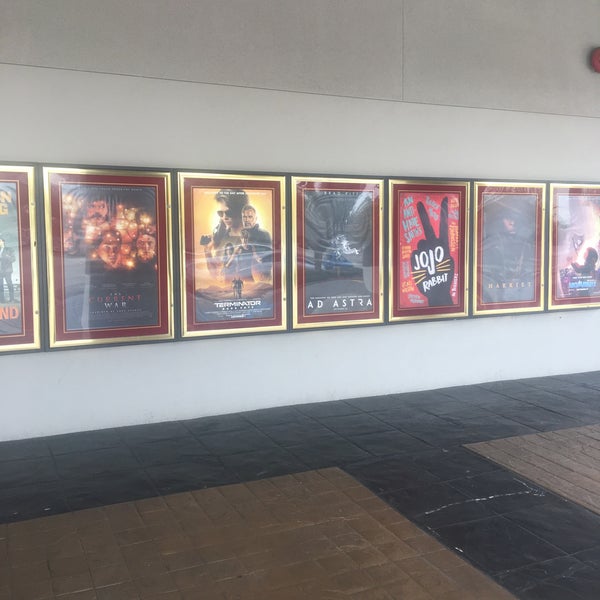
You are a GUI agent. You are given a task and a screenshot of the screen. Output one action in this format:
    pyautogui.click(x=<x>, y=<y>)
    Task: Click on the poster
    
    Given the screenshot: What is the action you would take?
    pyautogui.click(x=72, y=322)